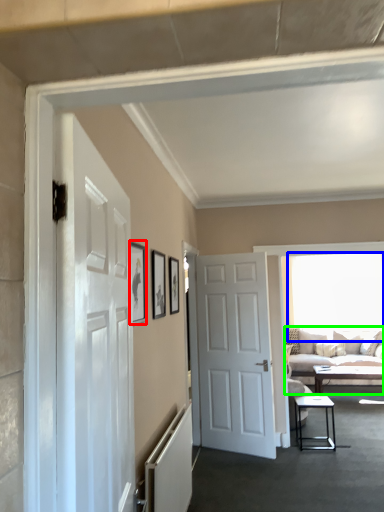
Question: Which is nearer to the picture frame (highlighted by a red box)? window (highlighted by a blue box) or studio couch (highlighted by a green box).

Choices:
 (A) window
 (B) studio couch

Answer: (B)